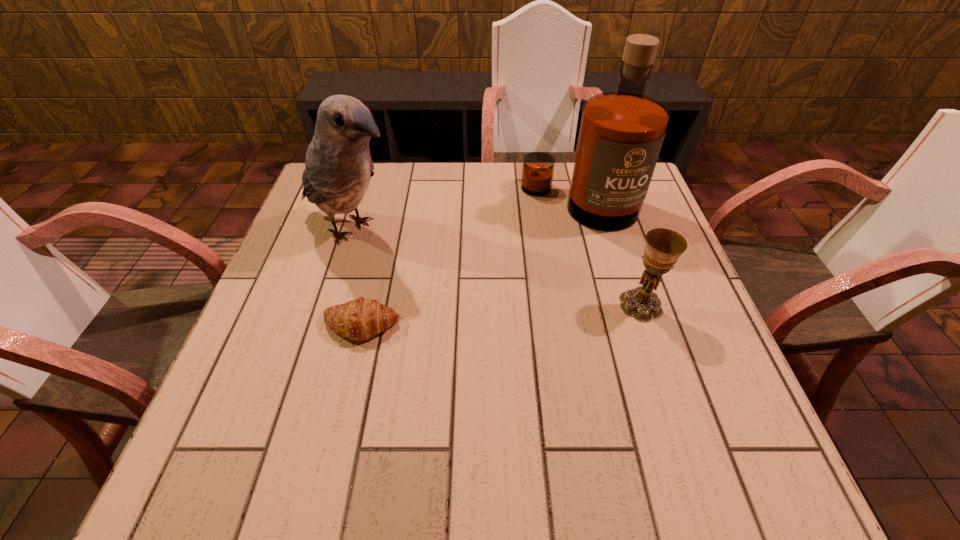
Where is `crescent roll`? This screenshot has height=540, width=960. crescent roll is located at coordinates (360, 319).

You are a GUI agent. You are given a task and a screenshot of the screen. Output one action in this format:
    pyautogui.click(x=<x>, y=<y>)
    Task: Click on the second shortest object
    This screenshot has height=540, width=960.
    Given the screenshot: What is the action you would take?
    pyautogui.click(x=663, y=247)

Identify the location of parrot. This screenshot has width=960, height=540. (338, 167).

You are a GUI agent. You are given a task and a screenshot of the screen. Output one action in this format:
    pyautogui.click(x=<x>, y=<y>)
    Task: Click on the liquor
    The image size is (960, 540).
    Given the screenshot: What is the action you would take?
    pyautogui.click(x=621, y=133)

Find the location of `free spot located 0.160m on the right of the shortest object`. free spot located 0.160m on the right of the shortest object is located at coordinates (477, 325).

This screenshot has height=540, width=960. What are the coordinates of `free space located 0.100m on the left of the third tallest object` in the screenshot? It's located at (572, 305).

At what (x,y) coordinates should I click in order to perform the action: click on free region located 0.380m on the front-facing side of the parrot. Please return your answer as a coordinate pair (x, y). This screenshot has height=540, width=960. Looking at the image, I should click on (527, 315).

Find the location of a particular element. The image size is (960, 540). free space located on the front-facing side of the parrot is located at coordinates (418, 258).

Identify the location of vacant point located 0.070m on the front-facing side of the parrot. (415, 256).

You are a GUI agent. You are given a task and a screenshot of the screen. Output one action in this format:
    pyautogui.click(x=<x>, y=<y>)
    Task: Click on the vacant region located on the front label of the liquor
    
    Given the screenshot: What is the action you would take?
    (514, 325)